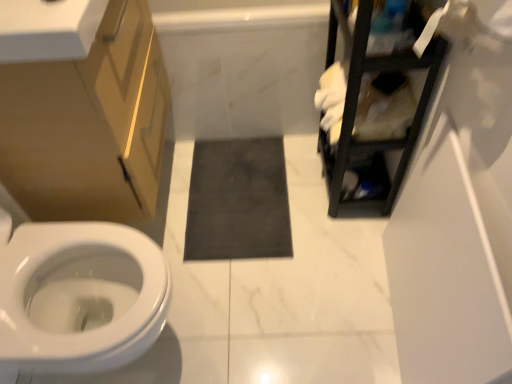
I want to click on vacant space in front of white marble bath at center, so click(259, 208).